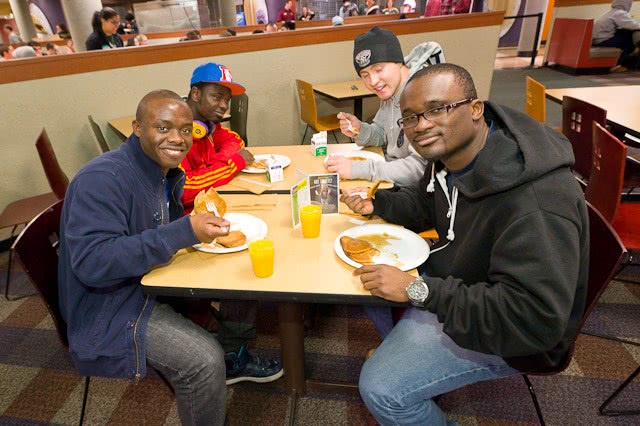
Locate an element on the screen. brown trim at top of half wall is located at coordinates (80, 62).